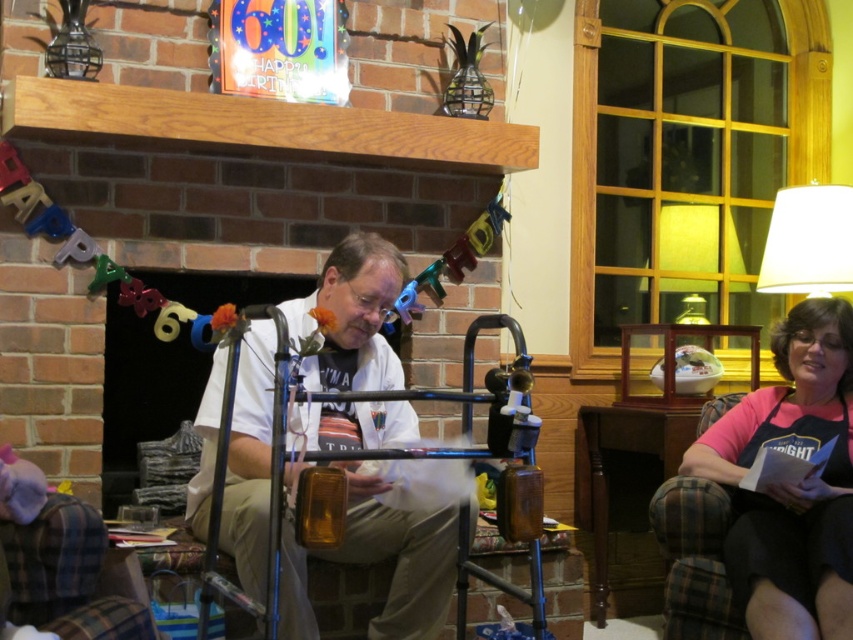
Question: Among these points, which one is nearest to the camera?

Choices:
 (A) (843, 442)
 (B) (727, 212)
 (C) (364, 339)

Answer: (C)

Question: Which is farther from the white matte walker at center?

Choices:
 (A) matte glass lampshade at upper right
 (B) pink fabric apron at lower right
 (C) white fabric lampshade at upper right

Answer: (A)

Question: Where is pink fabric apron at lower right located in relation to white fabric lampshade at upper right in the image?

Choices:
 (A) below
 (B) above

Answer: (A)

Question: Does white fabric lampshade at upper right lie in front of matte glass lampshade at upper right?

Choices:
 (A) yes
 (B) no

Answer: (A)

Question: Which point is farther from the camera taking this photo?

Choices:
 (A) (809, 236)
 (B) (669, 208)
 (C) (718, 424)
 (D) (317, 435)

Answer: (B)

Question: Can you confirm if white matte walker at center is positioned to the right of white fabric lampshade at upper right?

Choices:
 (A) yes
 (B) no

Answer: (B)